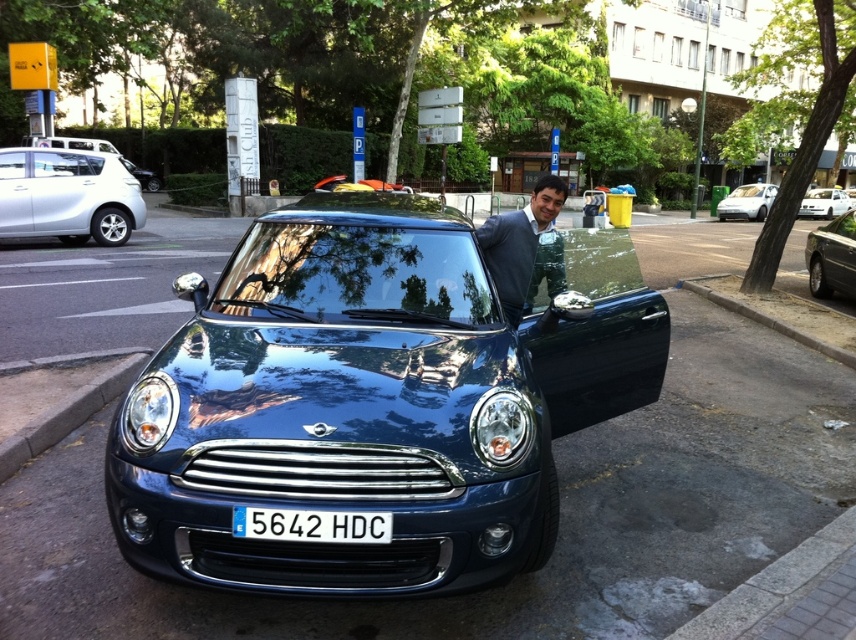
Question: Is white plastic license plate at center smaller than metallic silver sedan at right?

Choices:
 (A) yes
 (B) no

Answer: (A)

Question: Among these points, which one is nearest to the camera?

Choices:
 (A) (828, 211)
 (B) (837, 360)
 (C) (116, 150)
 (D) (343, 545)

Answer: (D)

Question: Can you confirm if silver metallic hatchback at left is thinner than white glossy car at right?

Choices:
 (A) no
 (B) yes

Answer: (B)

Question: Does smooth concrete curb at lower left have a lesser width compared to white glossy sedan at upper right?

Choices:
 (A) no
 (B) yes

Answer: (B)

Question: Which object is positioned closest to the white glossy car at right?

Choices:
 (A) shiny blue car at center
 (B) smooth concrete curb at lower left
 (C) matte blue suit at center

Answer: (C)

Question: Which object is the farthest from the white glossy sedan at upper right?

Choices:
 (A) silver metallic hatchback at left
 (B) metallic silver sedan at right
 (C) white glossy car at right
 (D) white plastic license plate at center

Answer: (A)